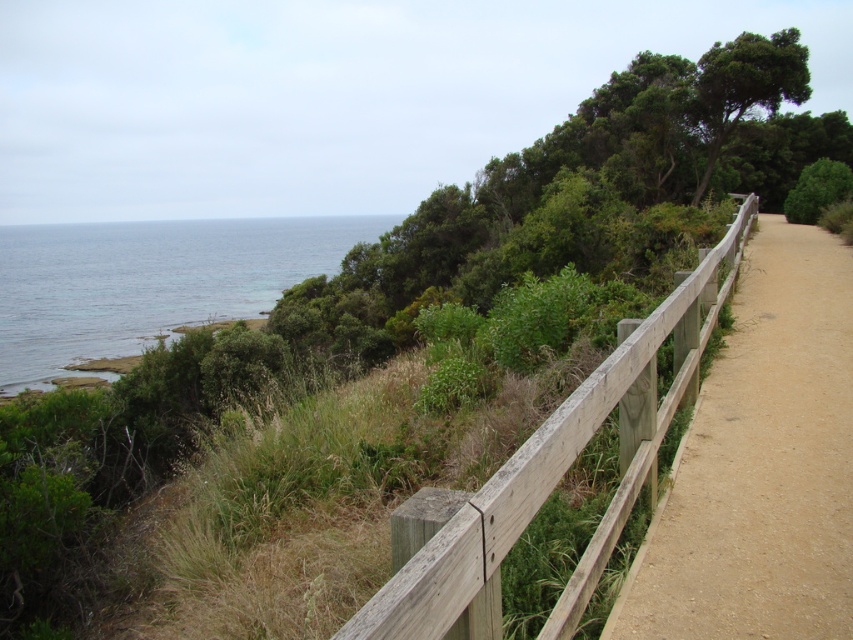
The width and height of the screenshot is (853, 640). What do you see at coordinates (761, 464) in the screenshot? I see `brown dirt path at center-right` at bounding box center [761, 464].

Can you confirm if brown dirt path at center-right is bigger than wooden fence at center-right?

Actually, brown dirt path at center-right might be smaller than wooden fence at center-right.

Where is `brown dirt path at center-right`? This screenshot has height=640, width=853. brown dirt path at center-right is located at coordinates (761, 464).

Consider the image. Is clear blue water at left smaller than wooden fence at center-right?

Incorrect, clear blue water at left is not smaller in size than wooden fence at center-right.

Is clear blue water at left taller than wooden fence at center-right?

Yes.

What do you see at coordinates (148, 282) in the screenshot?
I see `clear blue water at left` at bounding box center [148, 282].

Image resolution: width=853 pixels, height=640 pixels. In order to click on clear blue water at left in this screenshot , I will do `click(148, 282)`.

Between brown dirt path at center-right and clear blue water at left, which one is positioned lower?

brown dirt path at center-right

Consider the image. Can you confirm if brown dirt path at center-right is bigger than clear blue water at left?

Incorrect, brown dirt path at center-right is not larger than clear blue water at left.

This screenshot has width=853, height=640. Identify the location of brown dirt path at center-right. (761, 464).